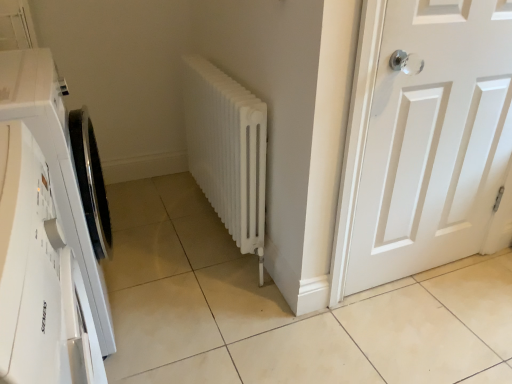
The width and height of the screenshot is (512, 384). Identify the location of vacant space underneath white matte door at right (from a real-world perspective). (417, 278).